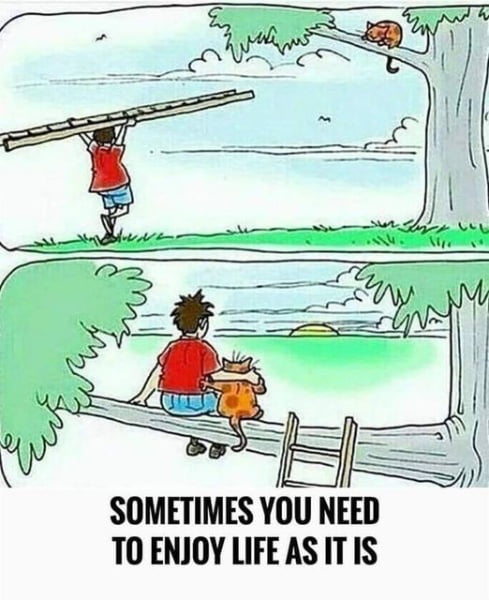
Identify the location of ladder. (153, 112), (288, 446).